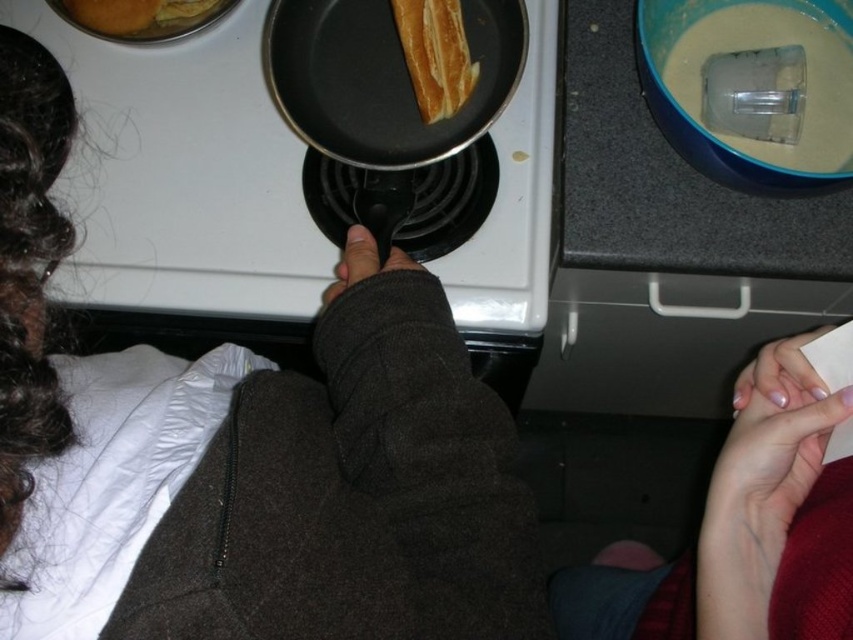
Is black matte pan at center to the left of clear plastic container at upper right from the viewer's perspective?

Correct, you'll find black matte pan at center to the left of clear plastic container at upper right.

Who is more forward, (474, 259) or (761, 157)?

Point (761, 157) is in front.

I want to click on black matte pan at center, so click(183, 176).

Can you confirm if black non-stick frying pan at center is smaller than clear plastic container at upper right?

No, black non-stick frying pan at center is not smaller than clear plastic container at upper right.

Between black non-stick frying pan at center and clear plastic container at upper right, which one is positioned higher?

black non-stick frying pan at center is higher up.

Does point (351, 12) come farther from viewer compared to point (746, 144)?

No, it is in front of (746, 144).

This screenshot has width=853, height=640. I want to click on black non-stick frying pan at center, so click(x=381, y=77).

Where is `clear plastic container at upper right`? The height and width of the screenshot is (640, 853). clear plastic container at upper right is located at coordinates (805, 83).

Between clear plastic container at upper right and golden matte bread at center, which one is positioned higher?

golden matte bread at center

Does point (753, 22) lie behind point (461, 17)?

Yes, point (753, 22) is farther from viewer.

This screenshot has height=640, width=853. What are the coordinates of `clear plastic container at upper right` in the screenshot? It's located at point(805,83).